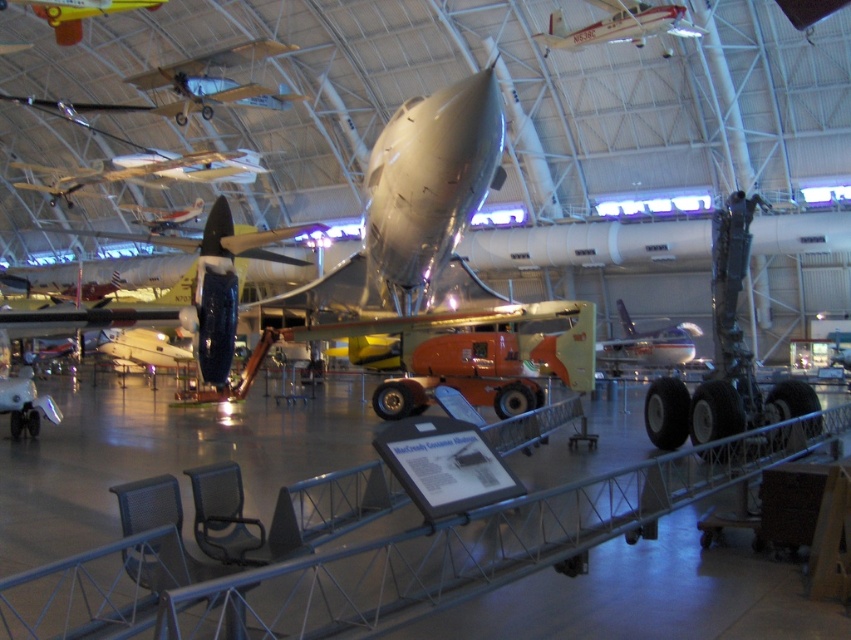
Who is higher up, metal/textured rail at center or silver metallic airplane at upper center?

silver metallic airplane at upper center is higher up.

Does metal/textured rail at center appear over silver metallic airplane at upper center?

Incorrect, metal/textured rail at center is not positioned above silver metallic airplane at upper center.

Is point (387, 550) positioned after point (697, 28)?

No.

Where is `metal/textured rail at center`? The image size is (851, 640). metal/textured rail at center is located at coordinates (380, 556).

Looking at this image, is shiny silver airplane at upper center shorter than matte orange airplane at center?

No, shiny silver airplane at upper center is not shorter than matte orange airplane at center.

Can you confirm if shiny silver airplane at upper center is positioned above matte orange airplane at center?

Yes.

Identify the location of shiny silver airplane at upper center. (160, 170).

Is matte orange airplane at center thinner than yellow matte airplane at upper left?

In fact, matte orange airplane at center might be wider than yellow matte airplane at upper left.

Does matte orange airplane at center appear under yellow matte airplane at upper left?

Yes.

Is point (683, 330) behind point (56, 28)?

Yes, it is behind point (56, 28).

At what (x,y) coordinates should I click in order to perform the action: click on matte orange airplane at center. Please return your answer as a coordinate pair (x, y). This screenshot has width=851, height=640. Looking at the image, I should click on (649, 342).